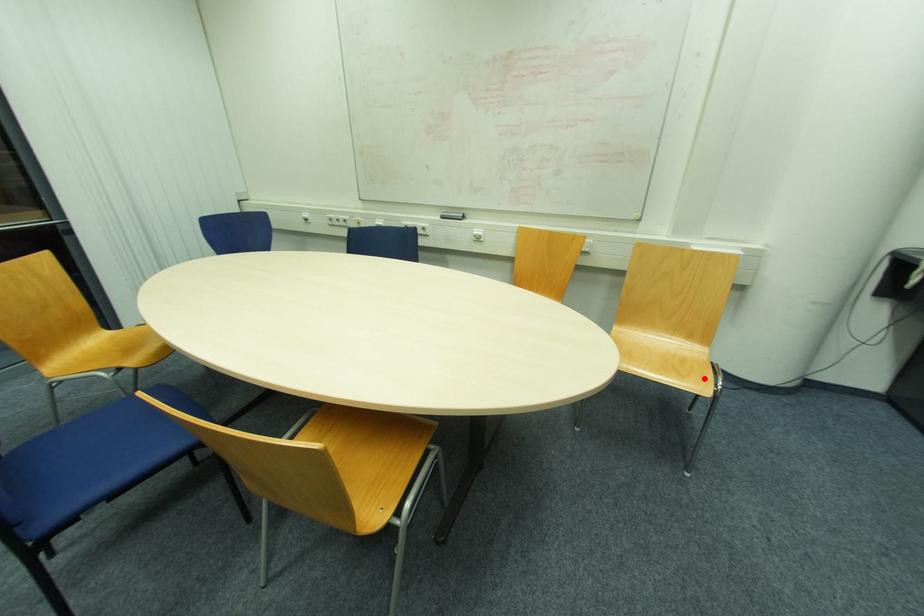
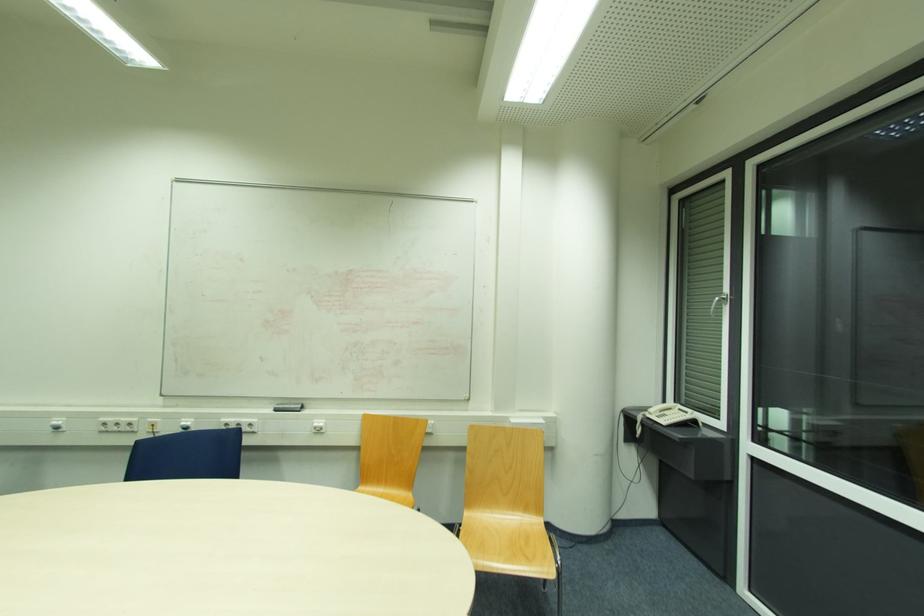
Find the pixel in the second image that matches the highlighted location in the first image.

(546, 557)